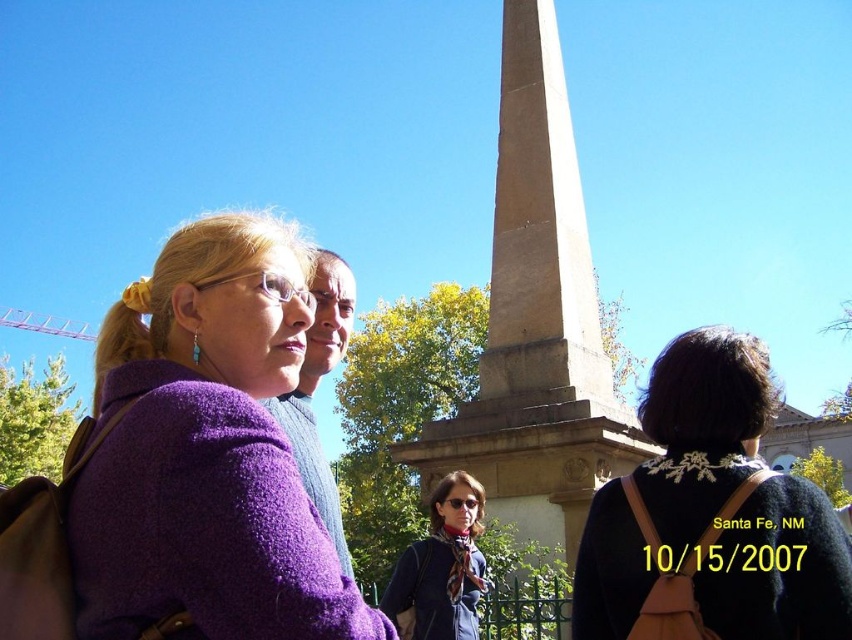
You are standing at the center of the scene. Which direction should you move to get closer to the purple fuzzy coat at left?

To get closer to the purple fuzzy coat at left, you should move to the left since the object is located at point (206, 452), which is on the left side of the scene.

You are standing at the base of the monument and want to place a small flag exactly at the point marked by point [292,636]. Given that the monument is 25 meters tall, can you estimate whether the flag will be placed within the monument or outside of it?

The point [292,636] is 20.89 meters from the viewer, so the flag will be placed outside the monument since it is beyond the monument which is 25 meters tall.

Based on the scene description, which object is taller between the black lace sweater at upper right and the brown stone obelisk at center?

The brown stone obelisk at center is taller than the black lace sweater at upper right.